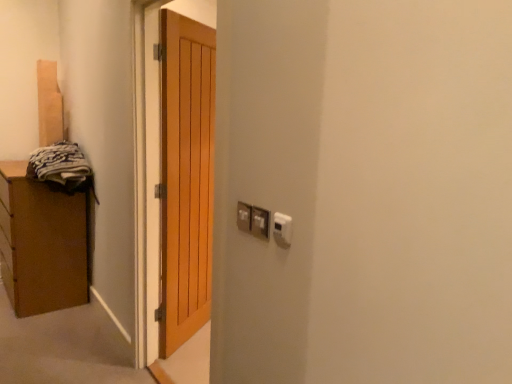
Question: Considering the positions of metallic silver electrical outlet at center-right, positioned as the 2th electric outlet in front-to-back order, and dark gray fabric at left in the image, is metallic silver electrical outlet at center-right, positioned as the 2th electric outlet in front-to-back order, bigger or smaller than dark gray fabric at left?

Choices:
 (A) small
 (B) big

Answer: (A)

Question: Based on their positions, is metallic silver electrical outlet at center-right, which is the 2th electric outlet from back to front, located to the left or right of dark gray fabric at left?

Choices:
 (A) right
 (B) left

Answer: (A)

Question: Which object is the farthest from the metallic silver electrical outlet at center-right, which is the 2th electric outlet from back to front?

Choices:
 (A) white plastic thermostat at upper right, which is counted as the third electric outlet, starting from the back
 (B) dark gray fabric at left
 (C) light brown wooden door at center
 (D) white plastic electric outlet at center, which is counted as the 3th electric outlet, starting from the front

Answer: (B)

Question: Estimate the real-world distances between objects in this image. Which object is farther from the metallic silver electrical outlet at center-right, positioned as the 2th electric outlet in front-to-back order?

Choices:
 (A) white plastic electric outlet at center, which is counted as the 3th electric outlet, starting from the front
 (B) dark gray fabric at left
 (C) white plastic thermostat at upper right, marked as the first electric outlet in a front-to-back arrangement
 (D) light brown wooden door at center

Answer: (B)